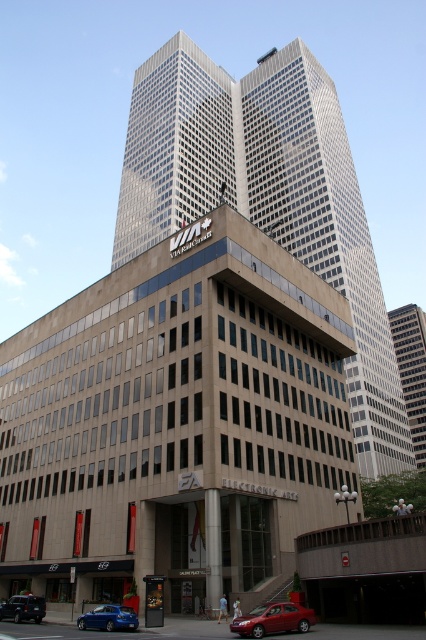
Does glassy steel skyscraper at center come in front of metallic blue hatchback at lower left?

No, glassy steel skyscraper at center is behind metallic blue hatchback at lower left.

Between glassy steel skyscraper at center and metallic blue hatchback at lower left, which one appears on the left side from the viewer's perspective?

From the viewer's perspective, metallic blue hatchback at lower left appears more on the left side.

Which is in front, point (405, 467) or point (104, 616)?

Point (104, 616)

The image size is (426, 640). In order to click on glassy steel skyscraper at center in this screenshot , I will do [x=267, y=196].

Based on the photo, is glassy steel skyscraper at center smaller than glassy reflective skyscraper at center?

Incorrect, glassy steel skyscraper at center is not smaller in size than glassy reflective skyscraper at center.

Can you confirm if glassy steel skyscraper at center is bigger than glassy reflective skyscraper at center?

Yes, glassy steel skyscraper at center is bigger than glassy reflective skyscraper at center.

The height and width of the screenshot is (640, 426). Identify the location of glassy steel skyscraper at center. (267, 196).

Which is behind, point (109, 618) or point (17, 596)?

Positioned behind is point (17, 596).

Does metallic blue hatchback at lower left come behind metallic blue sedan at lower left?

That is False.

Between point (124, 620) and point (11, 611), which one is positioned in front?

Point (124, 620) is more forward.

Identify the location of metallic blue hatchback at lower left. The image size is (426, 640). (109, 618).